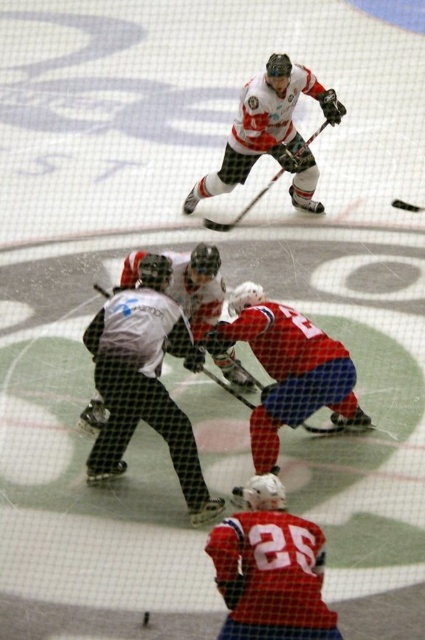
Is the position of white mesh referee at center less distant than that of matte black hockey stick at center?

That is True.

The image size is (425, 640). What are the coordinates of `white mesh referee at center` in the screenshot? It's located at (144, 380).